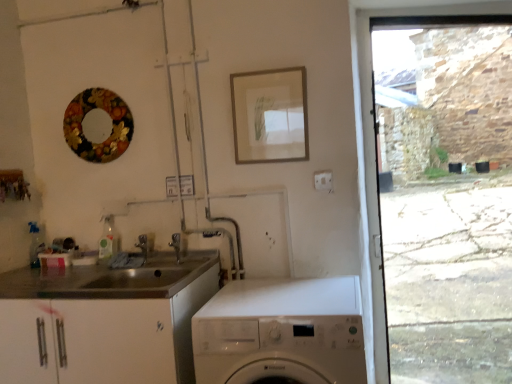
Where is `vacant area to the left of metallic silver faucet at upper center, which is the first tap in right-to-left order`? vacant area to the left of metallic silver faucet at upper center, which is the first tap in right-to-left order is located at coordinates (143, 272).